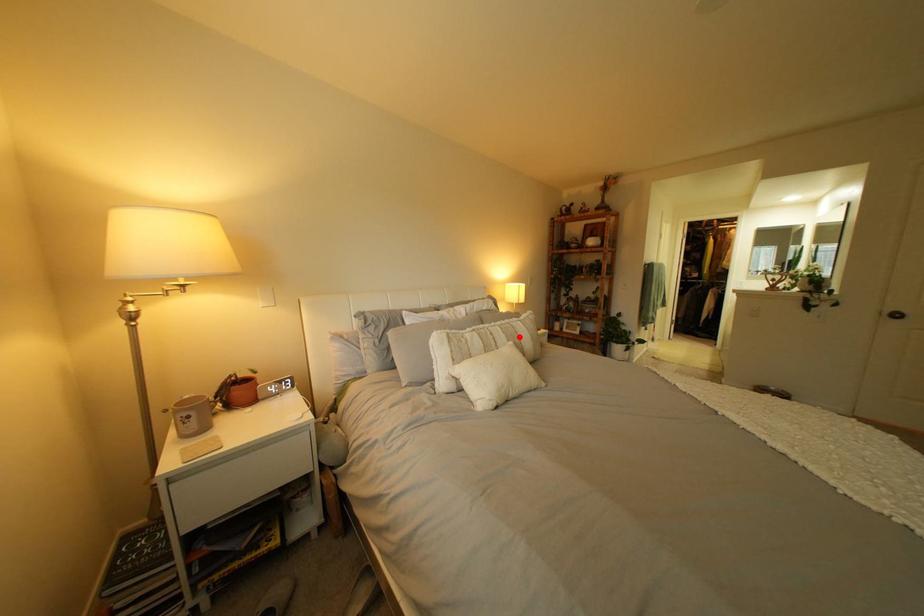
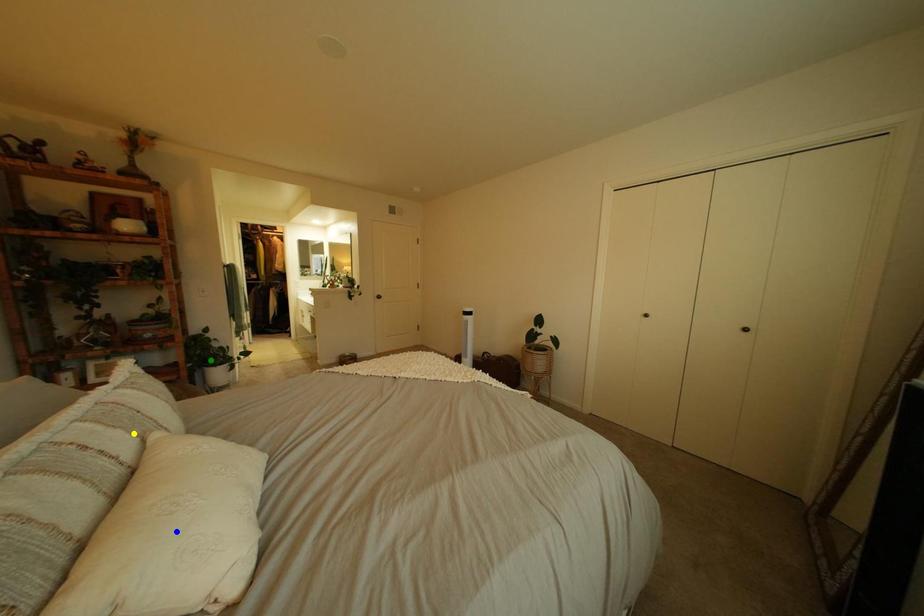
Question: I am providing you with two images of the same scene from different viewpoints. A red point is marked on the first image. You are given multiple points on the second image. Which spot in image 2 lines up with the point in image 1?

Choices:
 (A) blue point
 (B) yellow point
 (C) green point

Answer: (B)